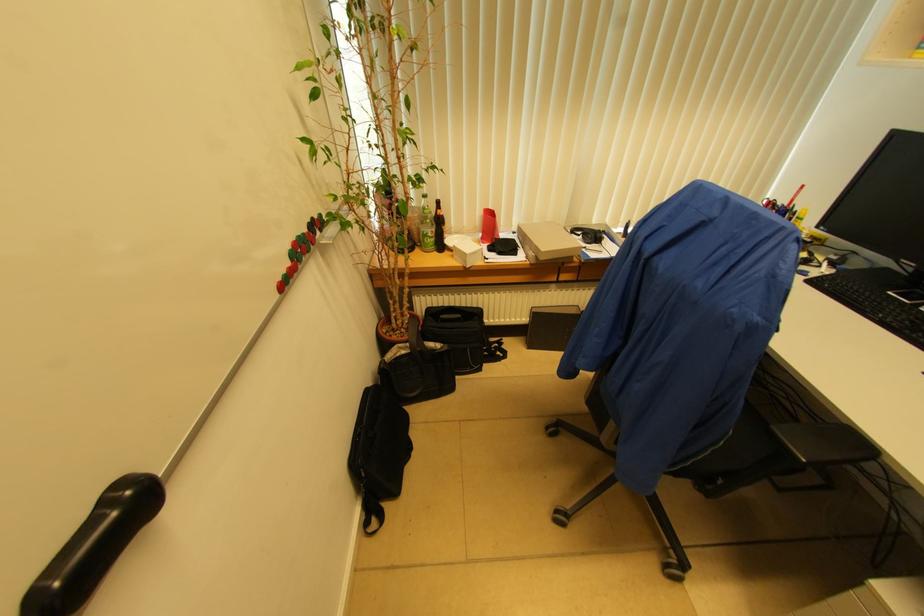
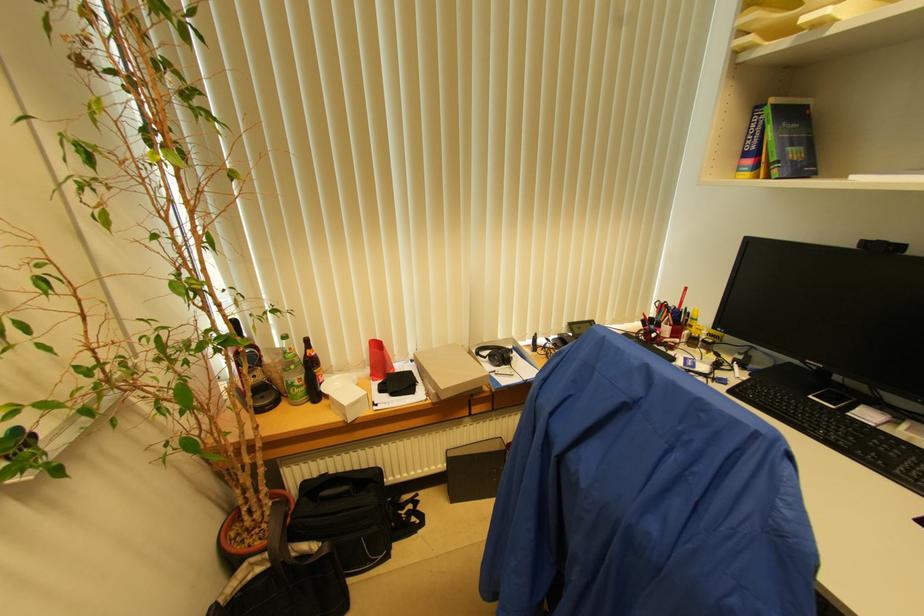
The point at [532,310] is marked in the first image. Where is the corresponding point in the second image?

(447, 453)